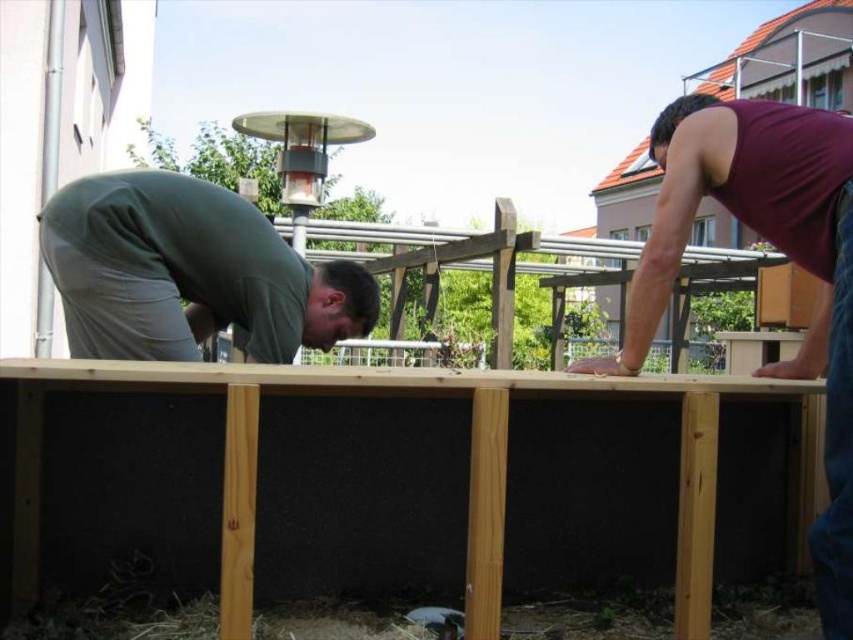
Is natural wood foundation at center above maroon tank top at upper right?

No.

From the picture: Is natural wood foundation at center in front of maroon tank top at upper right?

That is True.

This screenshot has width=853, height=640. I want to click on natural wood foundation at center, so click(405, 481).

Is point (778, 362) positioned before point (339, 308)?

Yes, point (778, 362) is in front of point (339, 308).

Is maroon tank top at upper right above green matte shirt at left?

No.

Image resolution: width=853 pixels, height=640 pixels. I want to click on maroon tank top at upper right, so click(x=779, y=250).

Can you confirm if natural wood foundation at center is positioned to the left of green matte shirt at left?

No, natural wood foundation at center is not to the left of green matte shirt at left.

Does point (769, 488) come behind point (280, 250)?

No, (769, 488) is closer to viewer.

I want to click on natural wood foundation at center, so click(x=405, y=481).